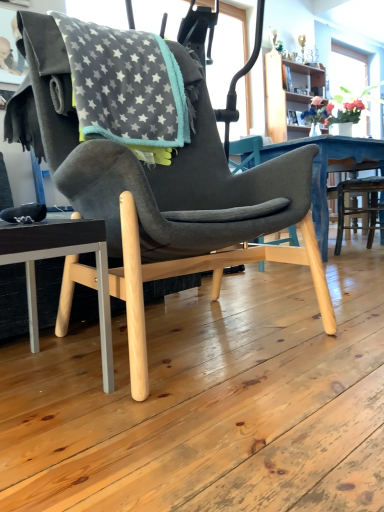
Question: Does wooden bookshelf at upper right have a smaller size compared to gray fleece blanket at upper left?

Choices:
 (A) yes
 (B) no

Answer: (B)

Question: Considering the relative sizes of wooden bookshelf at upper right and gray fleece blanket at upper left in the image provided, is wooden bookshelf at upper right thinner than gray fleece blanket at upper left?

Choices:
 (A) no
 (B) yes

Answer: (B)

Question: From a real-world perspective, is wooden bookshelf at upper right over gray fleece blanket at upper left?

Choices:
 (A) yes
 (B) no

Answer: (A)

Question: Does wooden bookshelf at upper right turn towards gray fleece blanket at upper left?

Choices:
 (A) yes
 (B) no

Answer: (B)

Question: Is wooden bookshelf at upper right outside gray fleece blanket at upper left?

Choices:
 (A) no
 (B) yes

Answer: (B)

Question: From the image's perspective, is wooden bookshelf at upper right over gray fleece blanket at upper left?

Choices:
 (A) no
 (B) yes

Answer: (B)

Question: From the image's perspective, would you say gray fleece blanket at upper left is shown under wooden bookshelf at upper right?

Choices:
 (A) yes
 (B) no

Answer: (A)

Question: Is gray fleece blanket at upper left facing away from wooden bookshelf at upper right?

Choices:
 (A) yes
 (B) no

Answer: (B)

Question: Considering the relative positions of gray fleece blanket at upper left and wooden bookshelf at upper right in the image provided, is gray fleece blanket at upper left to the left of wooden bookshelf at upper right from the viewer's perspective?

Choices:
 (A) no
 (B) yes

Answer: (B)

Question: Considering the relative sizes of gray fleece blanket at upper left and wooden bookshelf at upper right in the image provided, is gray fleece blanket at upper left smaller than wooden bookshelf at upper right?

Choices:
 (A) no
 (B) yes

Answer: (B)

Question: Is gray fleece blanket at upper left next to wooden bookshelf at upper right and touching it?

Choices:
 (A) no
 (B) yes

Answer: (A)

Question: Does gray fleece blanket at upper left have a greater height compared to wooden bookshelf at upper right?

Choices:
 (A) no
 (B) yes

Answer: (A)

Question: Is gray fleece blanket at upper left inside matte black chair at lower left?

Choices:
 (A) yes
 (B) no

Answer: (B)